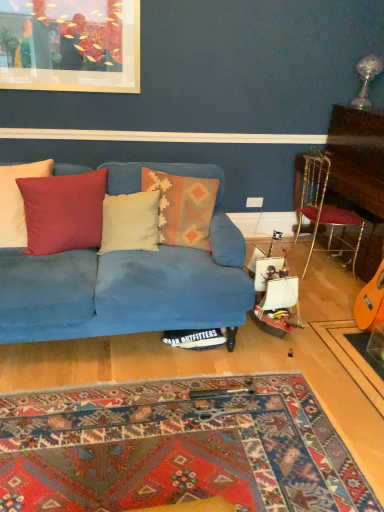
This screenshot has height=512, width=384. What are the coordinates of `textured woolen pillow at center, positioned as the fourth pillow in left-to-right order` in the screenshot? It's located at (183, 207).

The image size is (384, 512). In order to click on matte red cushion at center, marked as the 2th pillow in a left-to-right arrangement in this screenshot , I will do `click(63, 212)`.

In order to face matte red cushion at center, which ranks as the third pillow in right-to-left order, should I rotate leftwards or rightwards?

You should look left and rotate roughly 16.302 degrees.

At what (x,y) coordinates should I click in order to perform the action: click on white plastic power outlet at upper right. Please return your answer as a coordinate pair (x, y). The image size is (384, 512). Looking at the image, I should click on (254, 202).

Measure the distance between point (184, 495) and camera.

1.50 meters.

At what (x,y) coordinates should I click in order to perform the action: click on creamy soft pillow at center, marked as the 3th pillow in a left-to-right arrangement. Please return your answer as a coordinate pair (x, y). Looking at the image, I should click on (130, 222).

What is the approximate height of creamy soft pillow at center, arranged as the 2th pillow when viewed from the right?

creamy soft pillow at center, arranged as the 2th pillow when viewed from the right, is 41.85 centimeters in height.

Where is `textured woolen pillow at center, arranged as the 1th pillow when viewed from the right`? The height and width of the screenshot is (512, 384). textured woolen pillow at center, arranged as the 1th pillow when viewed from the right is located at coordinates (183, 207).

Is velvet blue couch at center located outside white plastic power outlet at upper right?

Indeed, velvet blue couch at center is completely outside white plastic power outlet at upper right.

From the image's perspective, which one is positioned lower, velvet blue couch at center or white plastic power outlet at upper right?

velvet blue couch at center, from the image's perspective.

Is velvet blue couch at center positioned in front of white plastic power outlet at upper right?

That is True.

Can you confirm if velvet blue couch at center is positioned to the right of white plastic power outlet at upper right?

No, velvet blue couch at center is not to the right of white plastic power outlet at upper right.

From the image's perspective, which is below, creamy soft pillow at center, marked as the 3th pillow in a left-to-right arrangement, or matte red cushion at center, which ranks as the third pillow in right-to-left order?

creamy soft pillow at center, marked as the 3th pillow in a left-to-right arrangement, is shown below in the image.

You are a GUI agent. You are given a task and a screenshot of the screen. Output one action in this format:
    pyautogui.click(x=<x>, y=<y>)
    Task: Click on the 2nd pillow in front of the creamy soft pillow at center, marked as the 3th pillow in a left-to-right arrangement, starting your count from the anchor
    This screenshot has width=384, height=512.
    Given the screenshot: What is the action you would take?
    pyautogui.click(x=63, y=212)

Is creamy soft pillow at center, arranged as the 2th pillow when viewed from the right, shorter than matte red cushion at center, which ranks as the third pillow in right-to-left order?

Correct, creamy soft pillow at center, arranged as the 2th pillow when viewed from the right, is not as tall as matte red cushion at center, which ranks as the third pillow in right-to-left order.

Is point (145, 243) closer or farther from the camera than point (53, 211)?

Clearly, point (145, 243) is more distant from the camera than point (53, 211).

Does matte red cushion at center, which ranks as the third pillow in right-to-left order, have a larger size compared to gold metallic chair at right?

Incorrect, matte red cushion at center, which ranks as the third pillow in right-to-left order, is not larger than gold metallic chair at right.

How much distance is there between matte red cushion at center, marked as the 2th pillow in a left-to-right arrangement, and gold metallic chair at right?

The distance of matte red cushion at center, marked as the 2th pillow in a left-to-right arrangement, from gold metallic chair at right is 5.46 feet.

Does matte red cushion at center, which ranks as the third pillow in right-to-left order, have a lesser height compared to gold metallic chair at right?

Yes, matte red cushion at center, which ranks as the third pillow in right-to-left order, is shorter than gold metallic chair at right.

Between matte red cushion at left, positioned as the first pillow in left-to-right order, and textured woolen pillow at center, arranged as the 1th pillow when viewed from the right, which one has smaller size?

Smaller between the two is matte red cushion at left, positioned as the first pillow in left-to-right order.

Considering the relative sizes of matte red cushion at left, positioned as the 4th pillow in right-to-left order, and textured woolen pillow at center, positioned as the fourth pillow in left-to-right order, in the image provided, is matte red cushion at left, positioned as the 4th pillow in right-to-left order, wider than textured woolen pillow at center, positioned as the fourth pillow in left-to-right order,?

No.

Is matte red cushion at left, positioned as the first pillow in left-to-right order, oriented away from textured woolen pillow at center, positioned as the fourth pillow in left-to-right order?

That's not correct — matte red cushion at left, positioned as the first pillow in left-to-right order, is not looking away from textured woolen pillow at center, positioned as the fourth pillow in left-to-right order.

How different are the orientations of creamy soft pillow at center, marked as the 3th pillow in a left-to-right arrangement, and carpet with intricate patterns at lower center in degrees?

The facing directions of creamy soft pillow at center, marked as the 3th pillow in a left-to-right arrangement, and carpet with intricate patterns at lower center are 78.7 degrees apart.

Looking at this image, does creamy soft pillow at center, arranged as the 2th pillow when viewed from the right, appear on the right side of carpet with intricate patterns at lower center?

No.

Can you confirm if creamy soft pillow at center, marked as the 3th pillow in a left-to-right arrangement, is thinner than carpet with intricate patterns at lower center?

Indeed, creamy soft pillow at center, marked as the 3th pillow in a left-to-right arrangement, has a lesser width compared to carpet with intricate patterns at lower center.

From the image's perspective, is matte red cushion at left, positioned as the first pillow in left-to-right order, above or below creamy soft pillow at center, marked as the 3th pillow in a left-to-right arrangement?

Based on their image positions, matte red cushion at left, positioned as the first pillow in left-to-right order, is located above creamy soft pillow at center, marked as the 3th pillow in a left-to-right arrangement.

Is matte red cushion at left, positioned as the first pillow in left-to-right order, thinner than creamy soft pillow at center, marked as the 3th pillow in a left-to-right arrangement?

Yes.

There is a creamy soft pillow at center, arranged as the 2th pillow when viewed from the right. Where is `the 3rd pillow above it (from a real-world perspective)`? The height and width of the screenshot is (512, 384). the 3rd pillow above it (from a real-world perspective) is located at coordinates (17, 201).

Considering the relative positions of matte red cushion at left, positioned as the first pillow in left-to-right order, and creamy soft pillow at center, marked as the 3th pillow in a left-to-right arrangement, in the image provided, is matte red cushion at left, positioned as the first pillow in left-to-right order, to the right of creamy soft pillow at center, marked as the 3th pillow in a left-to-right arrangement, from the viewer's perspective?

No.

Does matte red cushion at left, positioned as the 4th pillow in right-to-left order, have a lesser width compared to gold metallic chair at right?

Yes, matte red cushion at left, positioned as the 4th pillow in right-to-left order, is thinner than gold metallic chair at right.

Locate an element on the screen. Image resolution: width=384 pixels, height=512 pixels. the 3rd pillow in front of the gold metallic chair at right, counting from the anchor's position is located at coordinates (17, 201).

Is matte red cushion at left, positioned as the 4th pillow in right-to-left order, at the left side of gold metallic chair at right?

Correct, you'll find matte red cushion at left, positioned as the 4th pillow in right-to-left order, to the left of gold metallic chair at right.

Is point (17, 231) farther from camera compared to point (331, 208)?

No, it is not.

The image size is (384, 512). Identify the location of studio couch that is in front of the white plastic power outlet at upper right. (128, 279).

In order to click on pillow below the matte red cushion at center, marked as the 2th pillow in a left-to-right arrangement (from a real-world perspective) in this screenshot , I will do `click(130, 222)`.

When comparing their distances from creamy soft pillow at center, arranged as the 2th pillow when viewed from the right, does gold metallic chair at right or textured woolen pillow at center, positioned as the fourth pillow in left-to-right order, seem closer?

textured woolen pillow at center, positioned as the fourth pillow in left-to-right order.

From the image, which object appears to be farther from creamy soft pillow at center, marked as the 3th pillow in a left-to-right arrangement, velvet blue couch at center or carpet with intricate patterns at lower center?

The object further to creamy soft pillow at center, marked as the 3th pillow in a left-to-right arrangement, is carpet with intricate patterns at lower center.

Estimate the real-world distances between objects in this image. Which object is further from matte red cushion at left, positioned as the first pillow in left-to-right order, velvet blue couch at center or white plastic power outlet at upper right?

white plastic power outlet at upper right is positioned further to the anchor matte red cushion at left, positioned as the first pillow in left-to-right order.

Estimate the real-world distances between objects in this image. Which object is further from carpet with intricate patterns at lower center, white plastic power outlet at upper right or matte red cushion at center, which ranks as the third pillow in right-to-left order?

The object further to carpet with intricate patterns at lower center is white plastic power outlet at upper right.

Considering their positions, is matte red cushion at center, marked as the 2th pillow in a left-to-right arrangement, positioned closer to white plastic power outlet at upper right than carpet with intricate patterns at lower center?

matte red cushion at center, marked as the 2th pillow in a left-to-right arrangement.

Estimate the real-world distances between objects in this image. Which object is closer to carpet with intricate patterns at lower center, gold metallic chair at right or velvet blue couch at center?

velvet blue couch at center is positioned closer to the anchor carpet with intricate patterns at lower center.

Considering their positions, is matte red cushion at left, positioned as the 4th pillow in right-to-left order, positioned closer to velvet blue couch at center than matte red cushion at center, marked as the 2th pillow in a left-to-right arrangement?

matte red cushion at center, marked as the 2th pillow in a left-to-right arrangement, is closer to velvet blue couch at center.

Looking at the image, which one is located further to creamy soft pillow at center, arranged as the 2th pillow when viewed from the right, carpet with intricate patterns at lower center or matte red cushion at center, marked as the 2th pillow in a left-to-right arrangement?

carpet with intricate patterns at lower center lies further to creamy soft pillow at center, arranged as the 2th pillow when viewed from the right, than the other object.

The width and height of the screenshot is (384, 512). In order to click on power outlet between matte red cushion at left, positioned as the first pillow in left-to-right order, and gold metallic chair at right from left to right in this screenshot , I will do `click(254, 202)`.

Locate an element on the screen. studio couch between matte red cushion at left, positioned as the first pillow in left-to-right order, and gold metallic chair at right from left to right is located at coordinates (128, 279).

The image size is (384, 512). In order to click on studio couch between textured woolen pillow at center, positioned as the fourth pillow in left-to-right order, and carpet with intricate patterns at lower center from top to bottom in this screenshot , I will do `click(128, 279)`.

You are a GUI agent. You are given a task and a screenshot of the screen. Output one action in this format:
    pyautogui.click(x=<x>, y=<y>)
    Task: Click on the studio couch between matte red cushion at left, positioned as the first pillow in left-to-right order, and carpet with intricate patterns at lower center from top to bottom
    This screenshot has height=512, width=384.
    Given the screenshot: What is the action you would take?
    pyautogui.click(x=128, y=279)